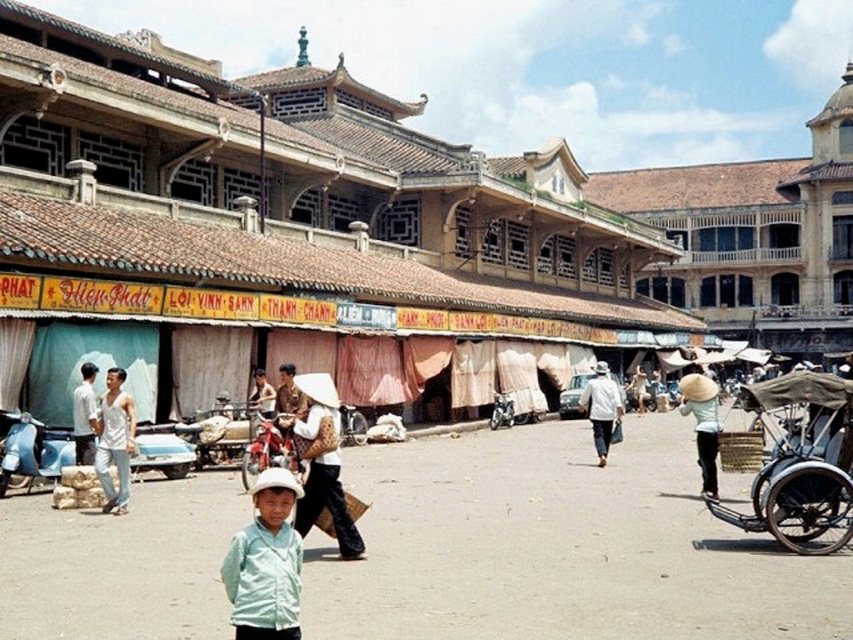
Is light blue fabric shirt at center above light brown woven hat at center?

Incorrect, light blue fabric shirt at center is not positioned above light brown woven hat at center.

You are a GUI agent. You are given a task and a screenshot of the screen. Output one action in this format:
    pyautogui.click(x=<x>, y=<y>)
    Task: Click on the light blue fabric shirt at center
    The height and width of the screenshot is (640, 853).
    Given the screenshot: What is the action you would take?
    pyautogui.click(x=265, y=563)

Is white cotton tank top at left bigger than light beige straw hat at center?

Actually, white cotton tank top at left might be smaller than light beige straw hat at center.

Is white cotton tank top at left taller than light beige straw hat at center?

No, white cotton tank top at left is not taller than light beige straw hat at center.

Image resolution: width=853 pixels, height=640 pixels. Find the location of `white cotton tank top at left`. white cotton tank top at left is located at coordinates (114, 442).

Who is higher up, wooden cart at right or matte white conical hat at center?

matte white conical hat at center is above.

Is point (753, 499) in front of point (337, 438)?

No, it is not.

Is point (834, 406) positioned before point (318, 468)?

No, (834, 406) is further to viewer.

Identify the location of wooden cart at right. (799, 465).